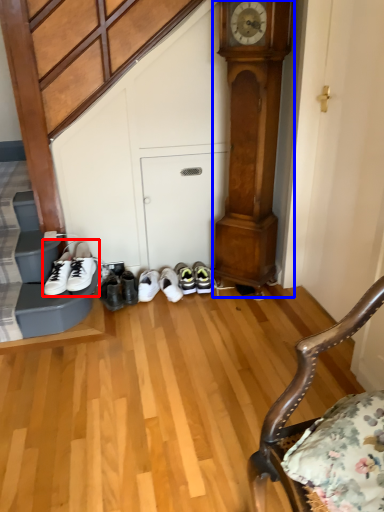
Question: Which point is closer to the camera, footwear (highlighted by a red box) or clock (highlighted by a blue box)?

Choices:
 (A) footwear
 (B) clock

Answer: (B)